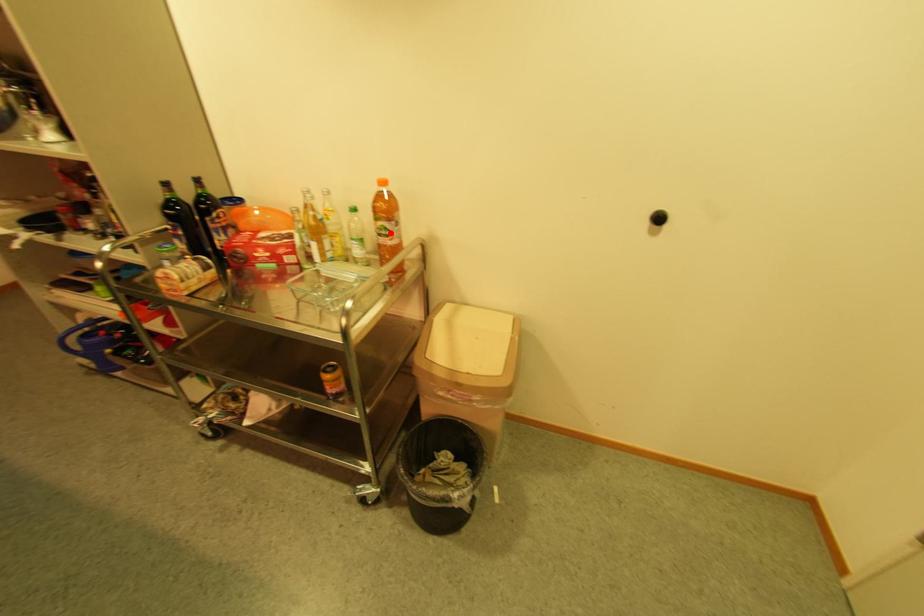
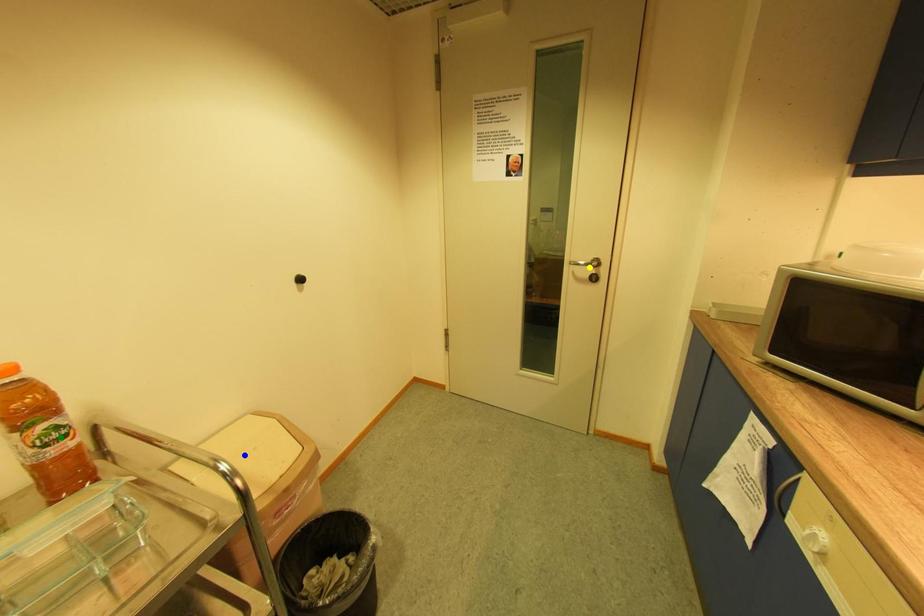
Question: I am providing you with two images of the same scene from different viewpoints. A red point is marked on the first image. You are given multiple points on the second image. Can you choose the point in image 2 that corresponds to the point in image 1?

Choices:
 (A) green point
 (B) yellow point
 (C) blue point

Answer: (A)